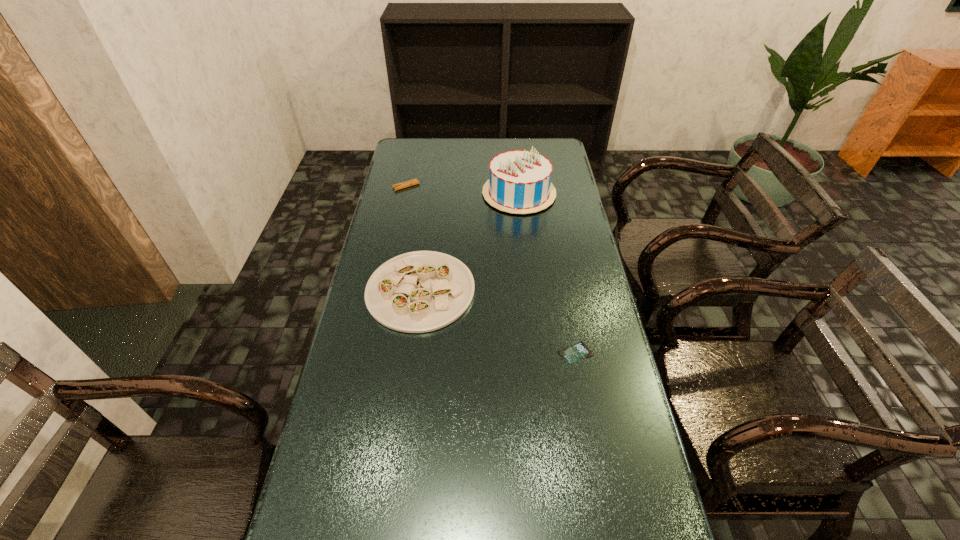
Locate an element on the screen. This screenshot has height=540, width=960. birthday cake is located at coordinates (519, 182).

Locate an element on the screen. the third farthest object is located at coordinates (421, 291).

The image size is (960, 540). In order to click on platter in this screenshot , I will do click(421, 291).

I want to click on the second shortest object, so click(x=405, y=184).

Where is `the nearest object`? This screenshot has height=540, width=960. the nearest object is located at coordinates pyautogui.click(x=577, y=352).

At what (x,y) coordinates should I click in order to perform the action: click on identity card. Please return your answer as a coordinate pair (x, y). Looking at the image, I should click on (577, 352).

At what (x,y) coordinates should I click in order to perform the action: click on blank space located 0.160m on the front of the birthday cake. Please return your answer as a coordinate pair (x, y). The height and width of the screenshot is (540, 960). Looking at the image, I should click on (524, 244).

Locate an element on the screen. The width and height of the screenshot is (960, 540). free space located on the back of the platter is located at coordinates (434, 190).

Where is `free location located 0.150m on the back of the second shortest object`? This screenshot has height=540, width=960. free location located 0.150m on the back of the second shortest object is located at coordinates (411, 162).

This screenshot has width=960, height=540. I want to click on vacant area situated 0.170m on the back of the identity card, so click(x=565, y=297).